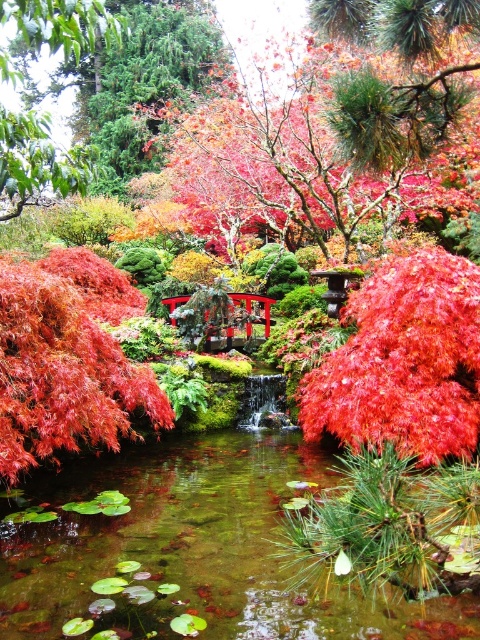
Does vivid red maple leaf at center have a greater height compared to shiny red maple at center?

Correct, vivid red maple leaf at center is much taller as shiny red maple at center.

Is point (412, 449) farther from viewer compared to point (112, 296)?

No, (412, 449) is in front of (112, 296).

Find the location of a particular element. The width and height of the screenshot is (480, 640). vivid red maple leaf at center is located at coordinates (404, 362).